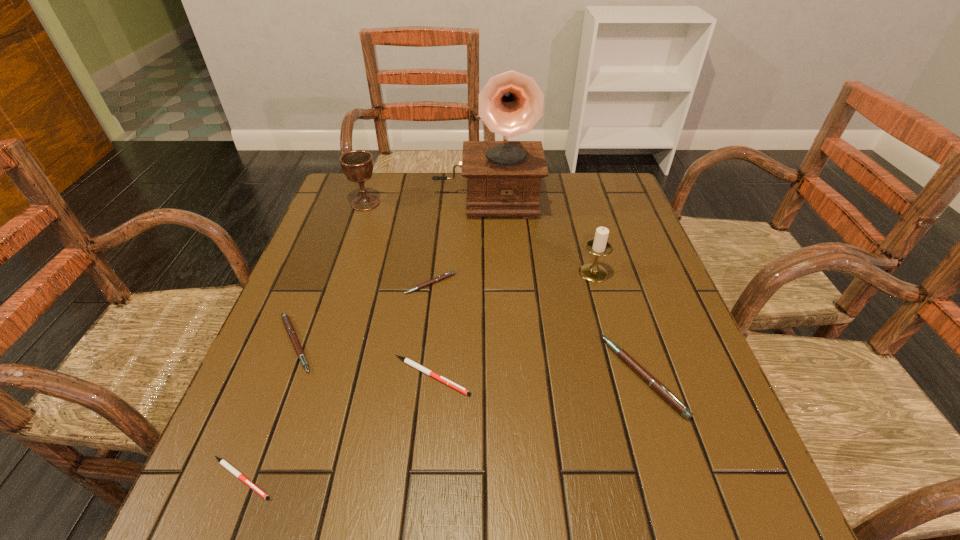
I want to click on object that is at the far left corner, so click(x=357, y=165).

The width and height of the screenshot is (960, 540). What are the coordinates of `object that is at the near left corner` in the screenshot? It's located at (230, 468).

The image size is (960, 540). I want to click on free space at the far edge of the desktop, so click(x=416, y=212).

Identify the location of free point at the near edge. Image resolution: width=960 pixels, height=540 pixels. (372, 517).

The width and height of the screenshot is (960, 540). What are the coordinates of `vacant space at the left edge of the desktop` in the screenshot? It's located at (296, 419).

The height and width of the screenshot is (540, 960). What are the coordinates of `vacant space at the right edge of the desktop` in the screenshot? It's located at (663, 319).

Identify the location of free space at the far left corner of the desktop. (343, 216).

In order to click on free spot at the far right corner of the desktop in this screenshot , I will do `click(588, 204)`.

Identify the location of vacant space at the near right corner. Image resolution: width=960 pixels, height=540 pixels. (749, 476).

Where is `unoccupied position between the candle holder and the second biggest pink pen`? This screenshot has width=960, height=540. unoccupied position between the candle holder and the second biggest pink pen is located at coordinates (444, 308).